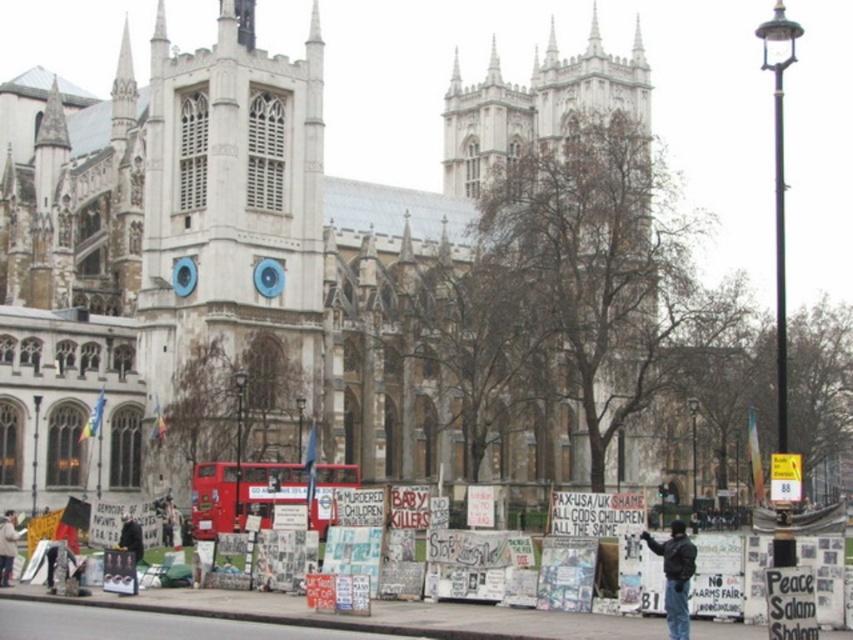
Question: Observing the image, what is the correct spatial positioning of white stone church at center in reference to dark brown leather jacket at lower left?

Choices:
 (A) left
 (B) right

Answer: (B)

Question: Is white stone church at center behind dark blue jacket at lower right?

Choices:
 (A) no
 (B) yes

Answer: (B)

Question: Which of the following is the farthest from the observer?

Choices:
 (A) white stone church at center
 (B) dark brown leather jacket at lower left
 (C) dark blue jacket at lower right

Answer: (A)

Question: Which of the following is the closest to the observer?

Choices:
 (A) white stone church at center
 (B) dark blue jacket at lower right
 (C) dark brown leather jacket at lower left

Answer: (B)

Question: Based on their relative distances, which object is farther from the dark brown leather jacket at lower left?

Choices:
 (A) dark blue jacket at lower right
 (B) white stone church at center

Answer: (B)

Question: Does dark blue jacket at lower right appear on the right side of dark brown leather jacket at lower left?

Choices:
 (A) no
 (B) yes

Answer: (B)